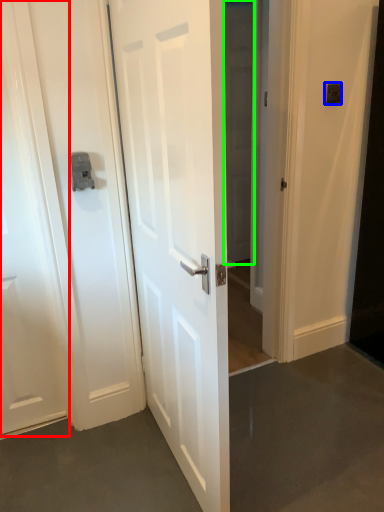
Question: Based on their relative distances, which object is nearer to door (highlighted by a red box)? Choose from light switch (highlighted by a blue box) and glass door (highlighted by a green box).

Choices:
 (A) light switch
 (B) glass door

Answer: (B)